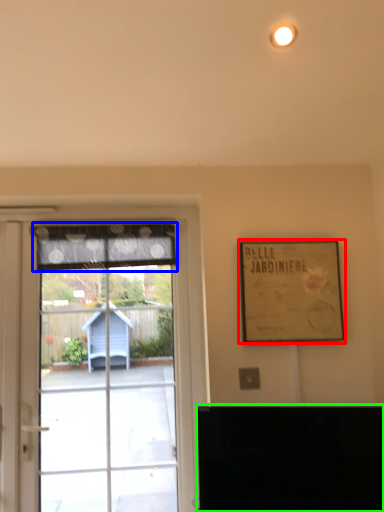
Question: Based on their relative distances, which object is farther from picture frame (highlighted by a red box)? Choose from curtain (highlighted by a blue box) and furniture (highlighted by a green box).

Choices:
 (A) curtain
 (B) furniture

Answer: (A)